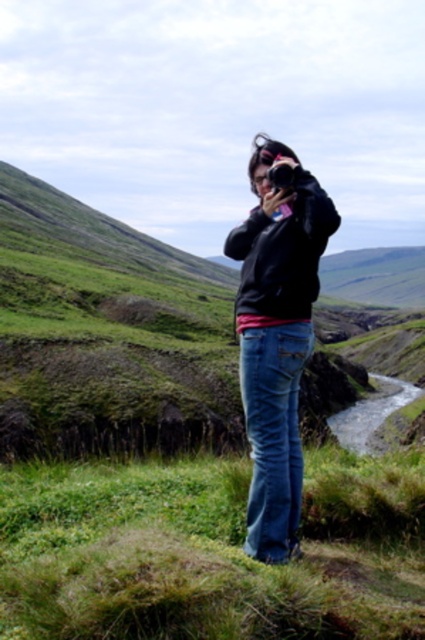
You are a photographer trying to capture the green grassy area at center in your photo. The black plastic camera at center is in your way. Can you move the camera to the side to get a clear shot of the green grassy at center?

The green grassy at center has a larger size compared to the black plastic camera at center. Since the camera is smaller, you can move it to the side to get a clear shot of the green grassy at center.